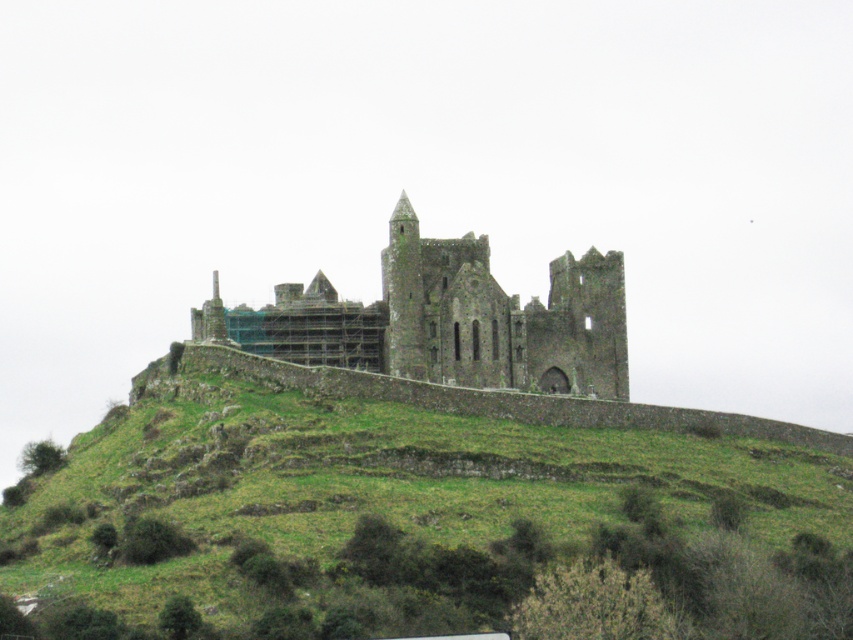
Question: Which point appears farthest from the camera in this image?

Choices:
 (A) [x=297, y=304]
 (B) [x=146, y=378]

Answer: (A)

Question: Is green grassy hillside at center below rusty stone castle at center?

Choices:
 (A) no
 (B) yes

Answer: (B)

Question: Is green grassy hillside at center above rusty stone castle at center?

Choices:
 (A) yes
 (B) no

Answer: (B)

Question: In this image, where is green grassy hillside at center located relative to rusty stone castle at center?

Choices:
 (A) below
 (B) above

Answer: (A)

Question: Which of the following is the farthest from the observer?

Choices:
 (A) (97, 536)
 (B) (485, 284)

Answer: (B)